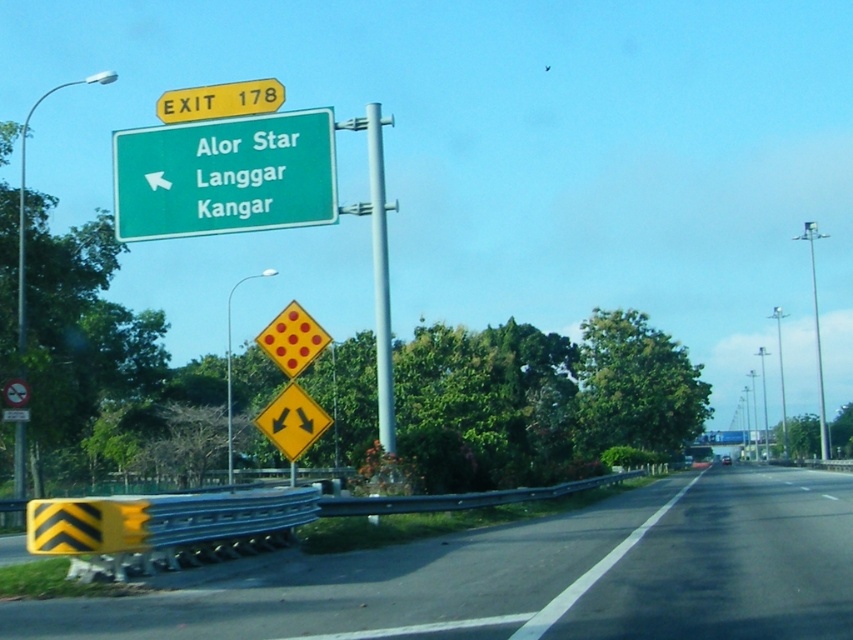
Between green matte signboard at upper left and silver metallic pole at center, which one is positioned higher?

Positioned higher is silver metallic pole at center.

Consider the image. Does green matte signboard at upper left have a larger size compared to silver metallic pole at center?

No.

Is point (125, 196) positioned after point (381, 282)?

Yes.

The width and height of the screenshot is (853, 640). What are the coordinates of `green matte signboard at upper left` in the screenshot? It's located at (225, 176).

Can you confirm if yellow reflective plastic guardrail at lower left is thinner than silver metallic pole at center?

Incorrect, yellow reflective plastic guardrail at lower left's width is not less than silver metallic pole at center's.

Does yellow reflective plastic guardrail at lower left appear under silver metallic pole at center?

Indeed, yellow reflective plastic guardrail at lower left is positioned under silver metallic pole at center.

What are the coordinates of `yellow reflective plastic guardrail at lower left` in the screenshot? It's located at (538, 577).

Is yellow matte exit sign at upper center further to camera compared to yellow reflective diamond at center?

Yes, yellow matte exit sign at upper center is behind yellow reflective diamond at center.

Can you confirm if yellow matte exit sign at upper center is positioned to the left of yellow reflective diamond at center?

Yes, yellow matte exit sign at upper center is to the left of yellow reflective diamond at center.

This screenshot has height=640, width=853. Find the location of `yellow matte exit sign at upper center`. yellow matte exit sign at upper center is located at coordinates (219, 100).